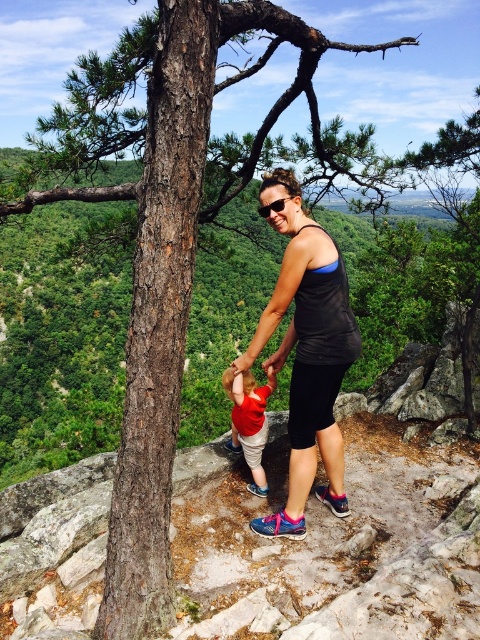
From the picture: You are a photographer planning to take a group photo of the woman and the child in the scene. The camera you are using has a focus range that can only accommodate subjects of similar height. Given the black matte tank top at center and the red cotton shirt at center, which one should be positioned closer to the camera to ensure both are in focus?

The red cotton shirt at center should be positioned closer to the camera because the black matte tank top at center is much taller. This adjustment will help ensure both are within the camera focus range.

You are a photographer trying to capture the woman and child in the scene. You notice the black matte tank top at center and the red cotton shirt at center. Which clothing item is located to the right of the other?

The black matte tank top at center is positioned on the right side of the red cotton shirt at center.